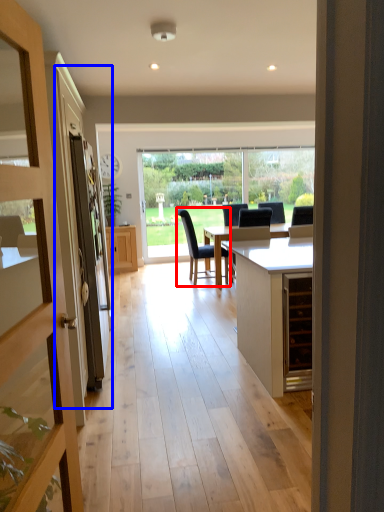
Question: Which object is closer to the camera taking this photo, chair (highlighted by a red box) or screen door (highlighted by a blue box)?

Choices:
 (A) chair
 (B) screen door

Answer: (B)